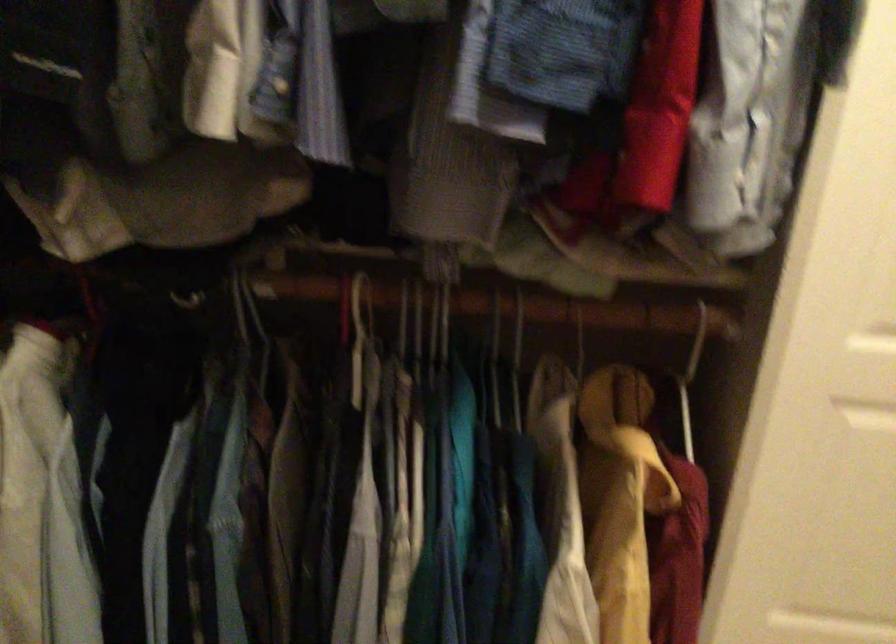
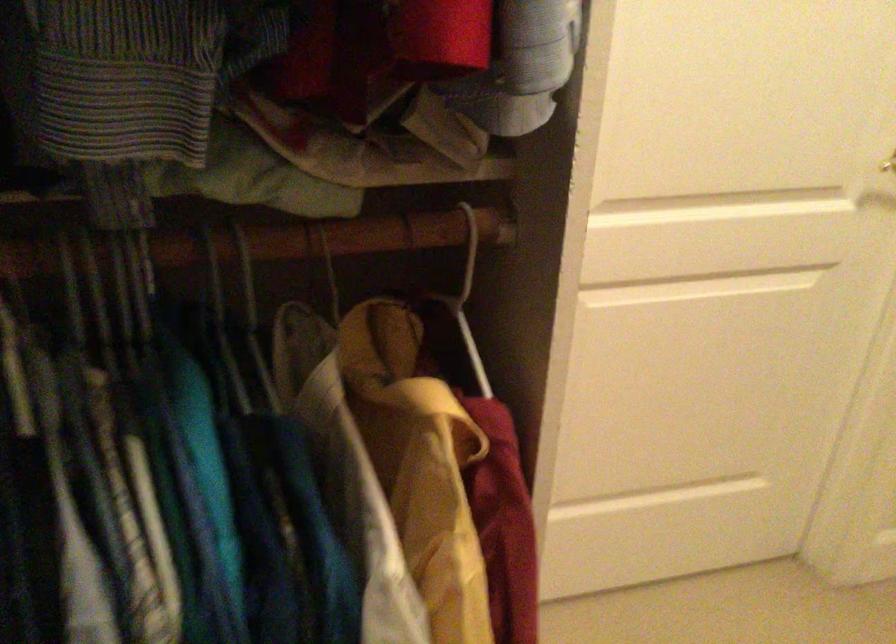
Question: The images are taken continuously from a first-person perspective. In which direction are you moving?

Choices:
 (A) Left
 (B) Right
 (C) Forward
 (D) Backward

Answer: (C)